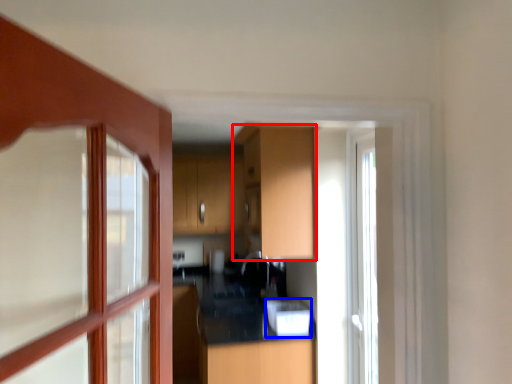
Question: Among these objects, which one is farthest to the camera, cabinetry (highlighted by a red box) or appliance (highlighted by a blue box)?

Choices:
 (A) cabinetry
 (B) appliance

Answer: (B)